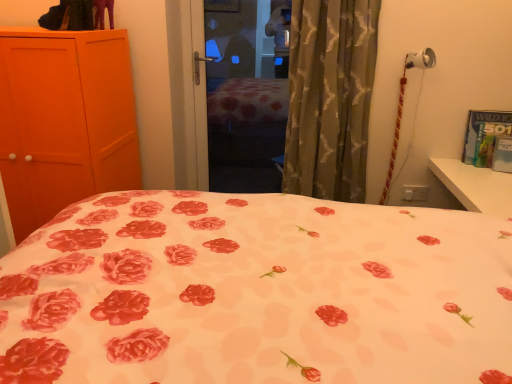
Question: From a real-world perspective, is matte red and white striped table lamp at upper right located higher than green textured curtain at right?

Choices:
 (A) yes
 (B) no

Answer: (B)

Question: From a real-world perspective, does matte red and white striped table lamp at upper right sit lower than green textured curtain at right?

Choices:
 (A) no
 (B) yes

Answer: (B)

Question: Is matte red and white striped table lamp at upper right completely or partially outside of green textured curtain at right?

Choices:
 (A) yes
 (B) no

Answer: (A)

Question: Considering the relative positions of matte red and white striped table lamp at upper right and green textured curtain at right in the image provided, is matte red and white striped table lamp at upper right in front of green textured curtain at right?

Choices:
 (A) no
 (B) yes

Answer: (A)

Question: Considering the relative positions of matte red and white striped table lamp at upper right and green textured curtain at right in the image provided, is matte red and white striped table lamp at upper right to the right of green textured curtain at right from the viewer's perspective?

Choices:
 (A) yes
 (B) no

Answer: (A)

Question: Could you tell me if matte red and white striped table lamp at upper right is turned towards green textured curtain at right?

Choices:
 (A) yes
 (B) no

Answer: (B)

Question: Is green textured curtain at right not inside matte red and white striped table lamp at upper right?

Choices:
 (A) yes
 (B) no

Answer: (A)

Question: From the image's perspective, is green textured curtain at right under matte red and white striped table lamp at upper right?

Choices:
 (A) no
 (B) yes

Answer: (A)

Question: From a real-world perspective, is green textured curtain at right over matte red and white striped table lamp at upper right?

Choices:
 (A) no
 (B) yes

Answer: (B)

Question: Does green textured curtain at right have a smaller size compared to matte red and white striped table lamp at upper right?

Choices:
 (A) no
 (B) yes

Answer: (A)

Question: Considering the relative positions of green textured curtain at right and matte red and white striped table lamp at upper right in the image provided, is green textured curtain at right to the right of matte red and white striped table lamp at upper right from the viewer's perspective?

Choices:
 (A) no
 (B) yes

Answer: (A)

Question: Does green textured curtain at right have a greater height compared to matte red and white striped table lamp at upper right?

Choices:
 (A) yes
 (B) no

Answer: (A)

Question: Does point (353, 165) appear closer or farther from the camera than point (380, 198)?

Choices:
 (A) closer
 (B) farther

Answer: (A)